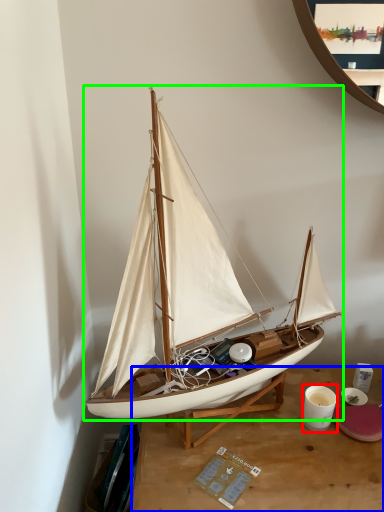
Question: Considering the real-world distances, which object is closest to coffee cup (highlighted by a red box)? desk (highlighted by a blue box) or boat (highlighted by a green box).

Choices:
 (A) desk
 (B) boat

Answer: (A)